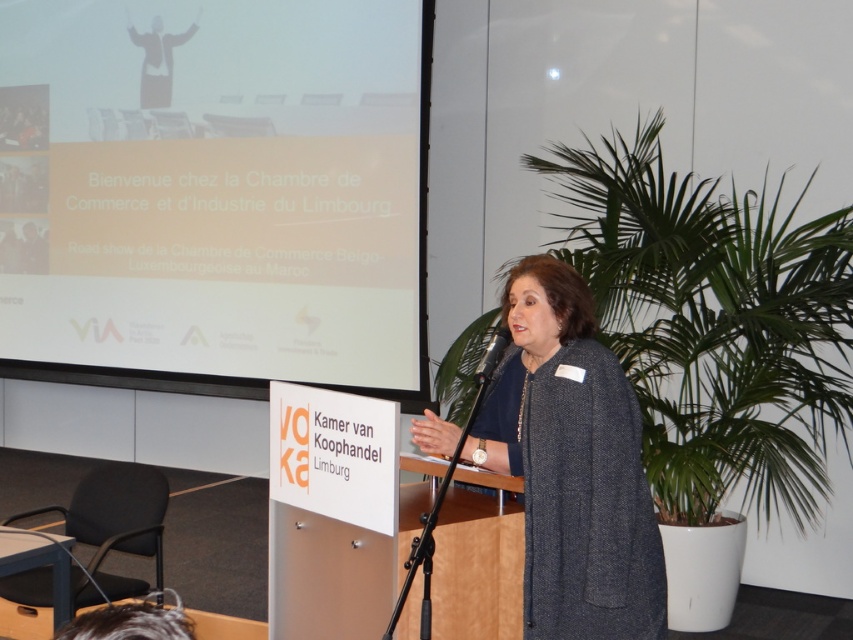
You are an event photographer in the conference room. You need to capture a clear photo of the black plastic microphone at center without the dark gray woolen coat at center blocking it. Is this possible given their current positions?

The dark gray woolen coat at center is in front of the black plastic microphone at center, so it is blocking the microphone. To capture a clear photo of the microphone without the coat blocking it, you would need to adjust your angle or position to avoid the coat.

You are an event organizer who needs to place a 2.5 meter wide banner between the dark gray woolen coat at center and the matte black suit at upper left. Can the banner fit without overlapping either object?

The dark gray woolen coat at center and matte black suit at upper left are 4.71 meters apart from each other. Since the banner is 2.5 meters wide, there is enough space between them to place the banner without overlapping either object.

You are a photographer adjusting your camera settings in the conference room. You notice two points marked in the scene at coordinates point (526, 586) and point (476, 381). Which point is closer to your camera lens?

Point (476, 381) is closer to the camera lens because it is less far than point (526, 586).